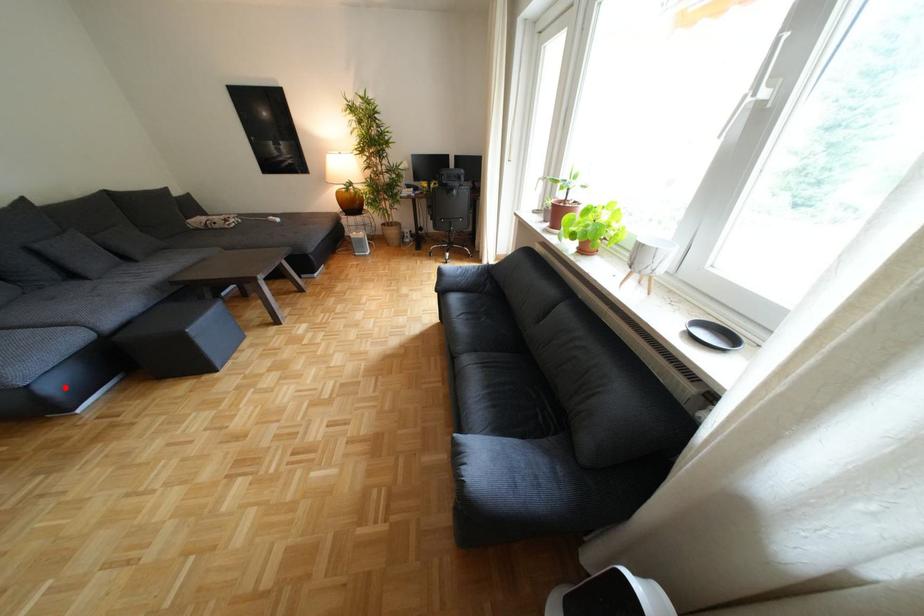
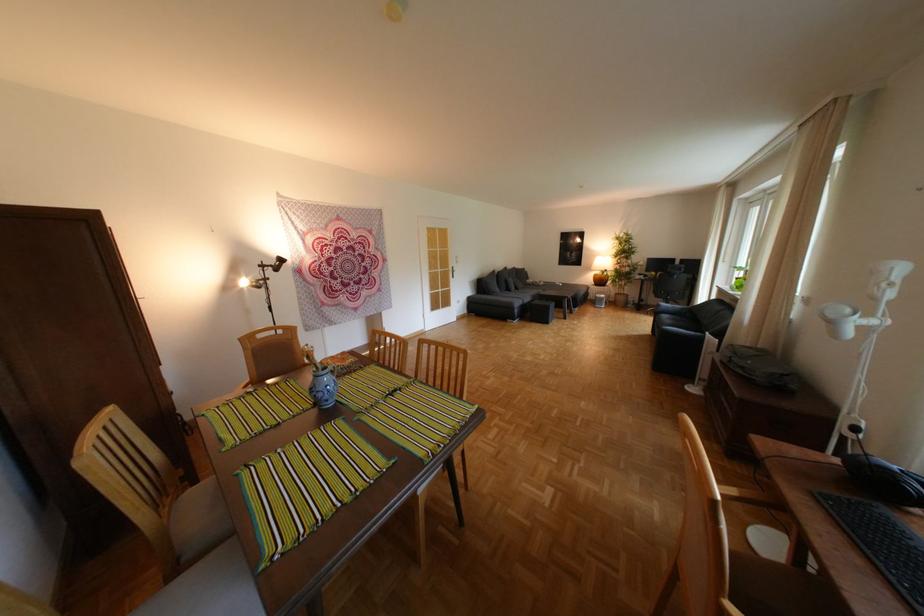
Question: A red point is marked in image1. In image2, is the corresponding 3D point closer to the camera or farther? Reply with the corresponding letter.

Choices:
 (A) The corresponding 3D point is closer.
 (B) The corresponding 3D point is farther.

Answer: (B)